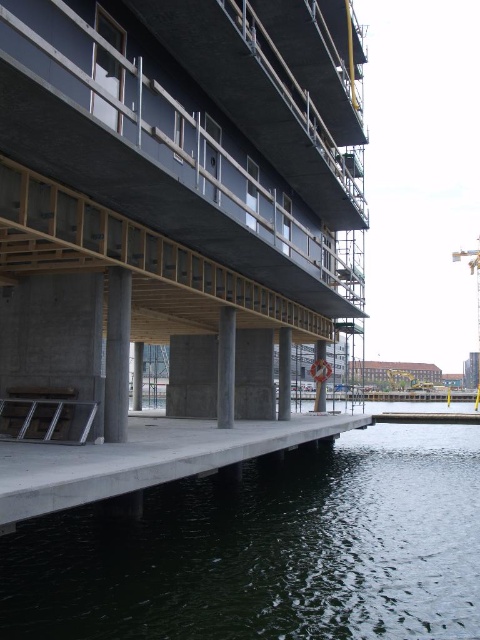
Question: Which object appears closest to the camera in this image?

Choices:
 (A) concrete/rough pillar at center
 (B) concrete/rough column at lower center
 (C) concrete at lower left
 (D) concrete/rough pillar at lower center

Answer: (C)

Question: Is concrete at lower left positioned at the back of concrete/rough column at lower center?

Choices:
 (A) yes
 (B) no

Answer: (B)

Question: Can you confirm if concrete/rough pillar at lower center is positioned to the right of concrete at lower center?

Choices:
 (A) no
 (B) yes

Answer: (A)

Question: Estimate the real-world distances between objects in this image. Which object is closer to the dark green concrete water at lower center?

Choices:
 (A) concrete at lower left
 (B) concrete/rough pillar at lower center
 (C) metallic silver crane at upper right
 (D) concrete at center

Answer: (A)

Question: Is metallic silver crane at upper right bigger than concrete/rough pillar at lower center?

Choices:
 (A) yes
 (B) no

Answer: (A)

Question: Which object is farther from the camera taking this photo?

Choices:
 (A) concrete/rough pillar at center
 (B) metallic silver crane at upper right

Answer: (B)